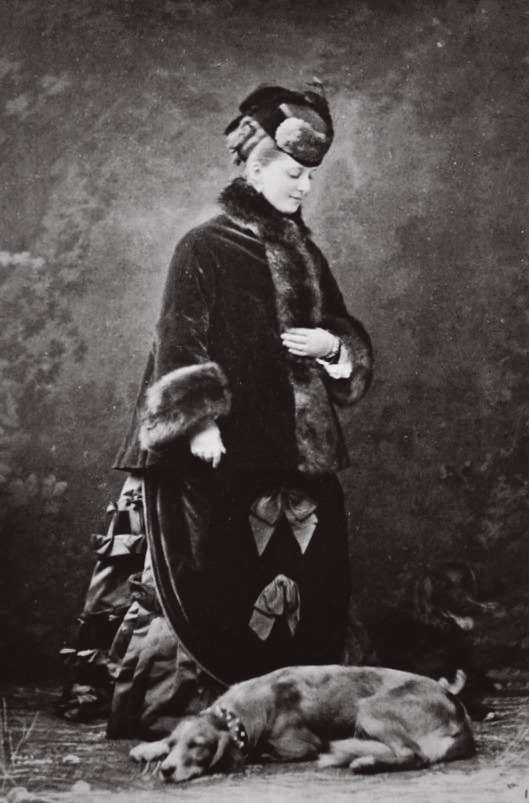
Locate an element on the screen. coat is located at coordinates (257, 318).